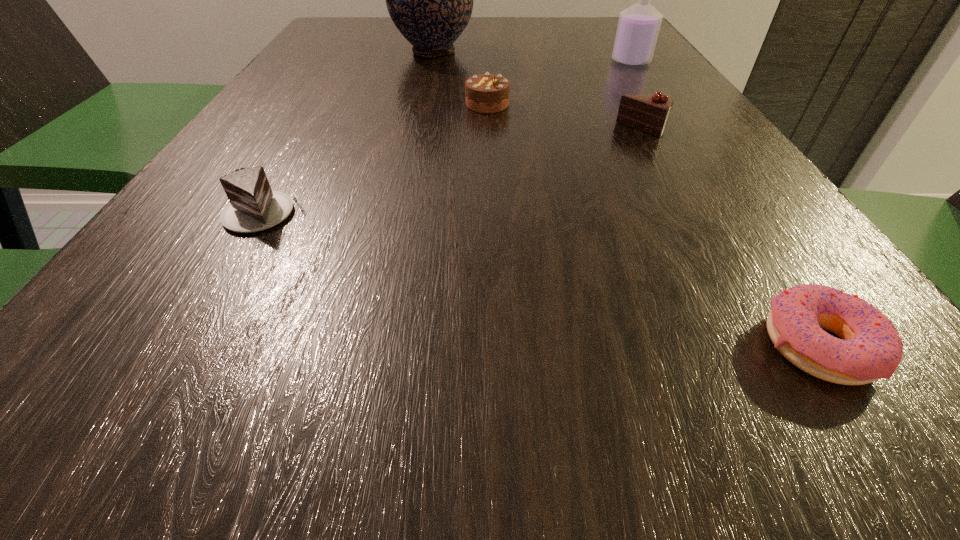
The image size is (960, 540). In order to click on chocolate cake that is the second nearest to the second chocolate cake from left to right in this screenshot , I will do `click(253, 206)`.

Where is `chocolate cake that is the third closest one to the perfume`? This screenshot has height=540, width=960. chocolate cake that is the third closest one to the perfume is located at coordinates (253, 206).

I want to click on free region that satisfies the following two spatial constraints: 1. on the front side of the doughnut; 2. on the left side of the rightmost chocolate cake, so click(763, 345).

This screenshot has height=540, width=960. I want to click on free location that satisfies the following two spatial constraints: 1. on the back side of the second nearest object; 2. on the right side of the third nearest object, so click(312, 130).